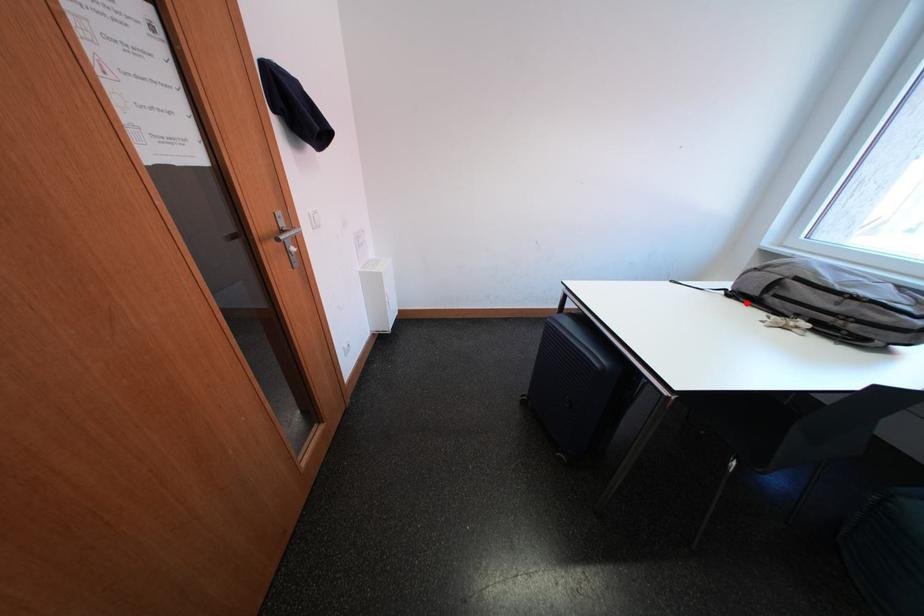
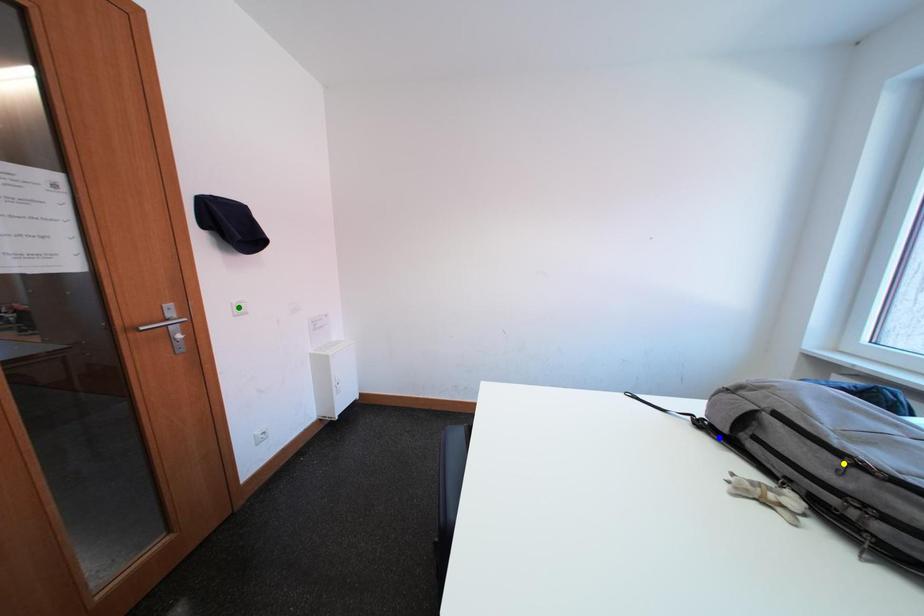
Question: I am providing you with two images of the same scene from different viewpoints. A red point is marked on the first image. You are given multiple points on the second image. Can you choose the point in image 2 that corresponds to the point in image 1?

Choices:
 (A) yellow point
 (B) green point
 (C) blue point

Answer: (C)